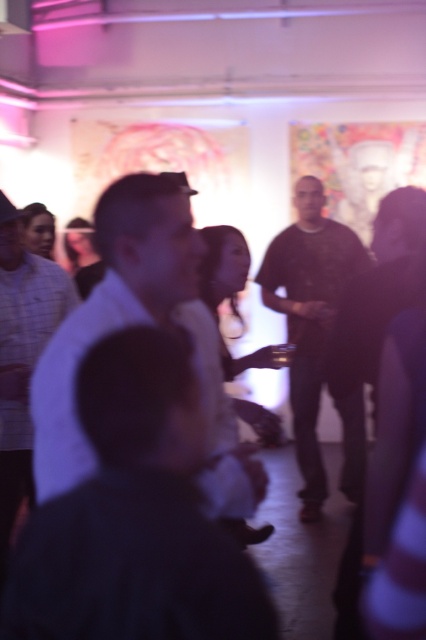
Is dark blue shirt at center above dark gray shirt at center?

Incorrect, dark blue shirt at center is not positioned above dark gray shirt at center.

Which is in front, point (227, 612) or point (362, 476)?

Point (227, 612) is more forward.

Image resolution: width=426 pixels, height=640 pixels. Find the location of `dark blue shirt at center`. dark blue shirt at center is located at coordinates (135, 516).

Who is shorter, dark blue shirt at center or white shirt at center?

Standing shorter between the two is dark blue shirt at center.

The image size is (426, 640). What are the coordinates of `dark blue shirt at center` in the screenshot? It's located at (135, 516).

Image resolution: width=426 pixels, height=640 pixels. Identify the location of dark blue shirt at center. 135,516.

Measure the distance from dark gray shirt at center to white matte shirt at center.

2.01 meters

Does dark gray shirt at center appear on the left side of white matte shirt at center?

No, dark gray shirt at center is not to the left of white matte shirt at center.

Is point (324, 305) in front of point (28, 381)?

That is False.

This screenshot has height=640, width=426. In order to click on dark gray shirt at center in this screenshot , I will do `click(310, 316)`.